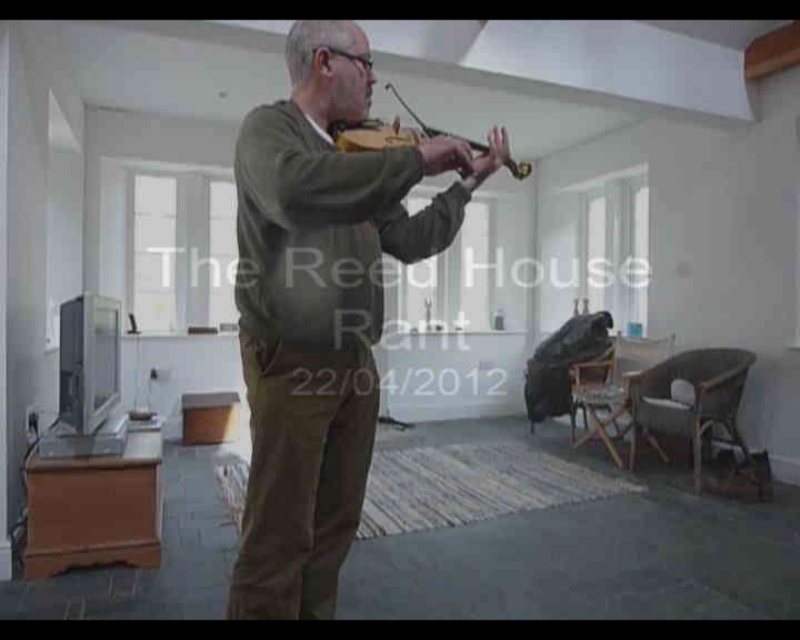
Who is lower down, matte green sweater at center or wooden violin at center?

matte green sweater at center is below.

In order to click on matte green sweater at center in this screenshot , I will do `click(320, 308)`.

In order to click on matte green sweater at center in this screenshot , I will do `click(320, 308)`.